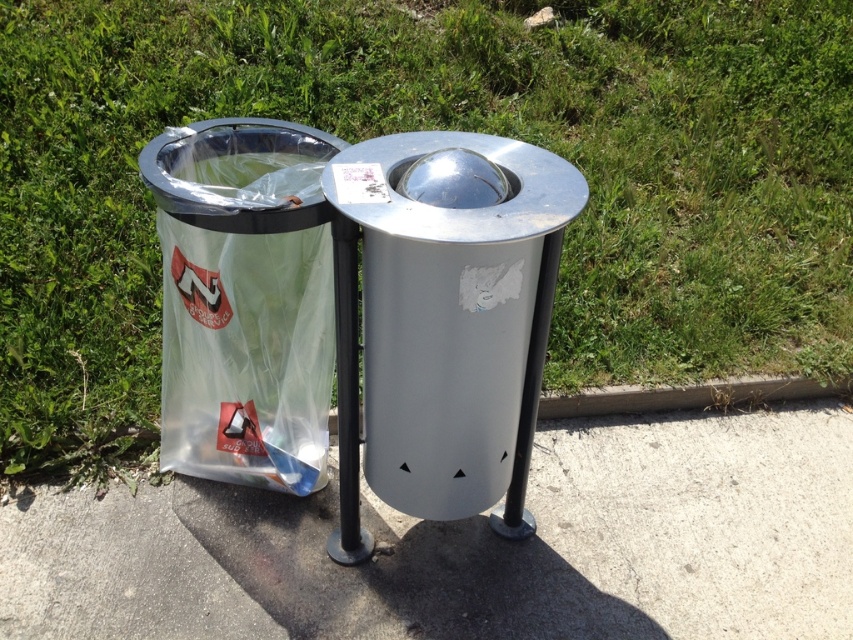
Looking at this image, you are standing at the point marked by coordinates point (602, 634) and want to throw a ball to a friend who is standing at the viewer position. If the ball travels in a straight line, will it pass between the two trash bins shown in the scene? Please explain your reasoning.

The point marked by coordinates point (602, 634) and the viewer are 2.29 meters apart. Since the trash bins are placed side by side on a paved surface between them, the ball traveling in a straight line would pass between the two trash bins shown in the scene.

You are standing at the edge of the gray concrete pavement at lower center and want to pick up a leaf that is 2 meters away from you. Can you reach it without moving your feet?

The gray concrete pavement at lower center and viewer are 2.21 meters apart from each other. Since the leaf is only 2 meters away from you, you can reach it without moving your feet because it is closer than the distance between you and the pavement.

You are a delivery person trying to park your bike. You see the gray concrete pavement at lower center and the clear plastic bag at left. Which one is more to the right?

The gray concrete pavement at lower center is more to the right than the clear plastic bag at left.